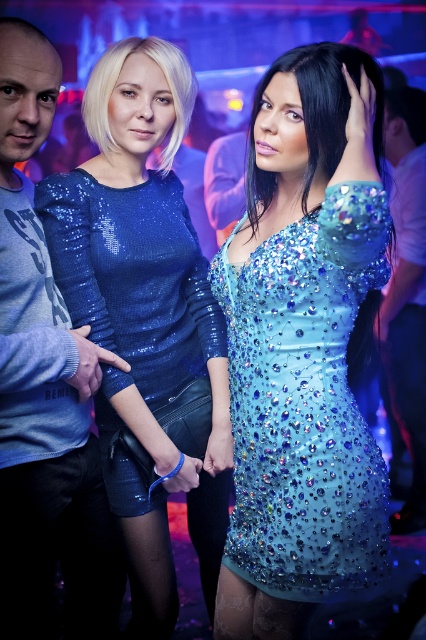
Question: Among these objects, which one is nearest to the camera?

Choices:
 (A) sequined blue dress at center
 (B) light blue sweatshirt at left

Answer: (A)

Question: Does light blue sweatshirt at left have a larger size compared to white glossy shirt at right?

Choices:
 (A) yes
 (B) no

Answer: (B)

Question: Which point appears closest to the camera in this image?

Choices:
 (A) (158, 394)
 (B) (344, 502)
 (C) (97, 508)

Answer: (B)

Question: Is sequined blue dress at center smaller than light blue sweatshirt at left?

Choices:
 (A) yes
 (B) no

Answer: (A)

Question: Among these objects, which one is farthest from the camera?

Choices:
 (A) blue sequined dress at center
 (B) sequined blue dress at center

Answer: (A)

Question: Does blue sequined dress at center lie in front of light blue sweatshirt at left?

Choices:
 (A) yes
 (B) no

Answer: (B)